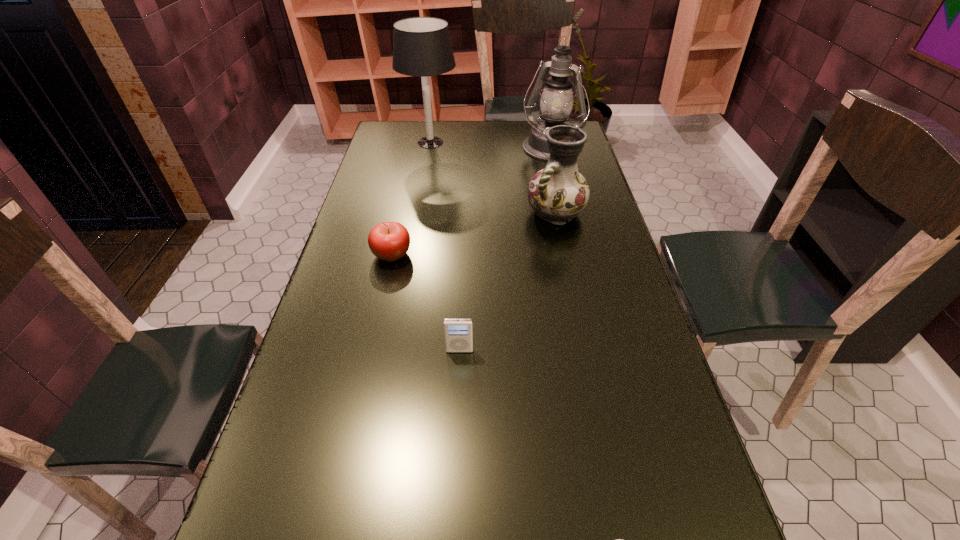
Identify the location of free space at the left edge of the desktop. This screenshot has width=960, height=540. (389, 150).

Locate an element on the screen. The image size is (960, 540). vacant space at the right edge of the desktop is located at coordinates (647, 328).

Find the location of a particular element. vacant area that lies between the table lamp and the oil lamp is located at coordinates (491, 146).

Find the location of a particular element. vacant space that is in between the iPod and the apple is located at coordinates pos(425,302).

You are a GUI agent. You are given a task and a screenshot of the screen. Output one action in this format:
    pyautogui.click(x=<x>, y=<y>)
    Task: Click on the unoccupied area between the third farthest object and the third object from left to right
    
    Given the screenshot: What is the action you would take?
    pyautogui.click(x=508, y=282)

Find the location of `free space between the table lamp and the vase`. free space between the table lamp and the vase is located at coordinates (493, 178).

Identify the location of empty space between the fourth farthest object and the vase. (473, 234).

The height and width of the screenshot is (540, 960). I want to click on vacant region between the vase and the second nearest object, so click(508, 282).

This screenshot has height=540, width=960. I want to click on free spot between the apple and the vase, so click(473, 234).

Identify the location of object that is the fifth closest one to the third object from left to right. (422, 47).